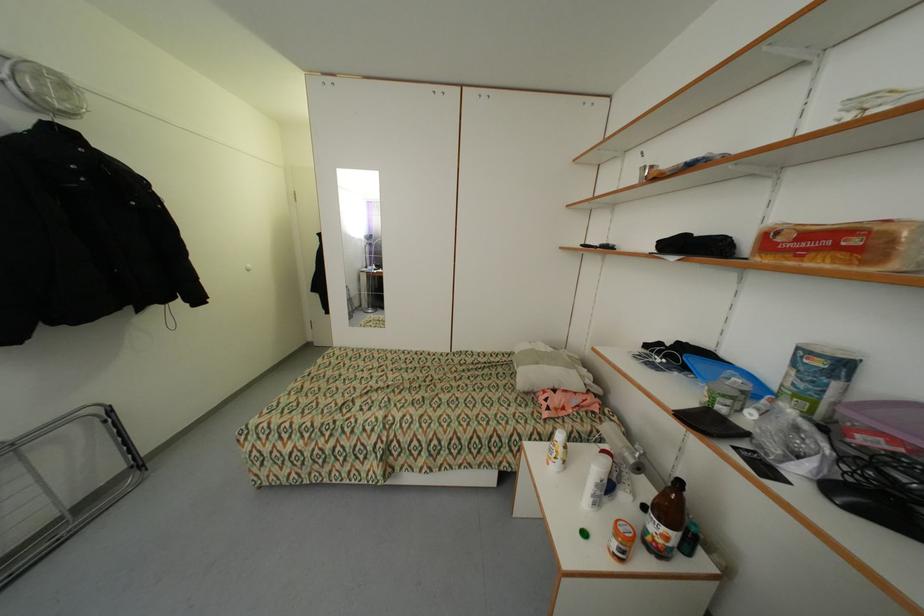
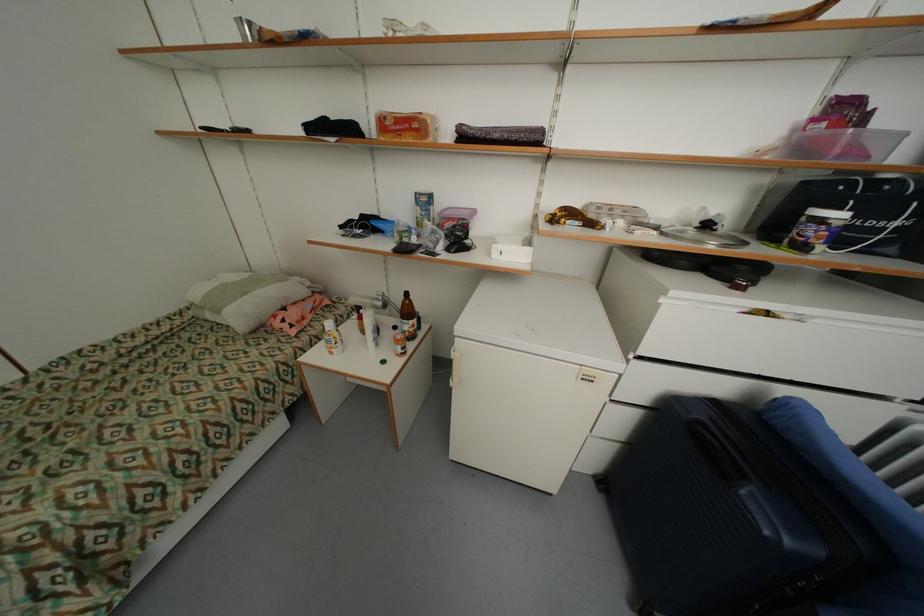
In the second image, find the point that corresponds to the point at 617,243 in the first image.

(248, 128)